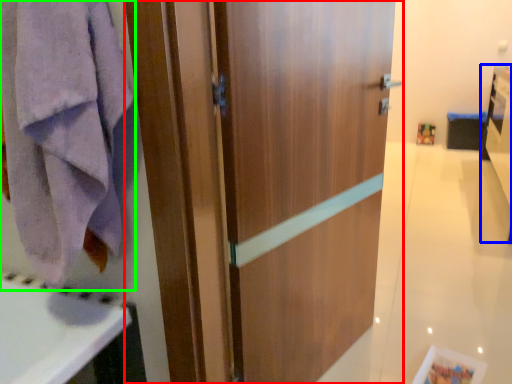
Question: Which object is the closest to the door (highlighted by a red box)? Choose among these: vanity (highlighted by a blue box) or towel/napkin (highlighted by a green box).

Choices:
 (A) vanity
 (B) towel/napkin

Answer: (B)